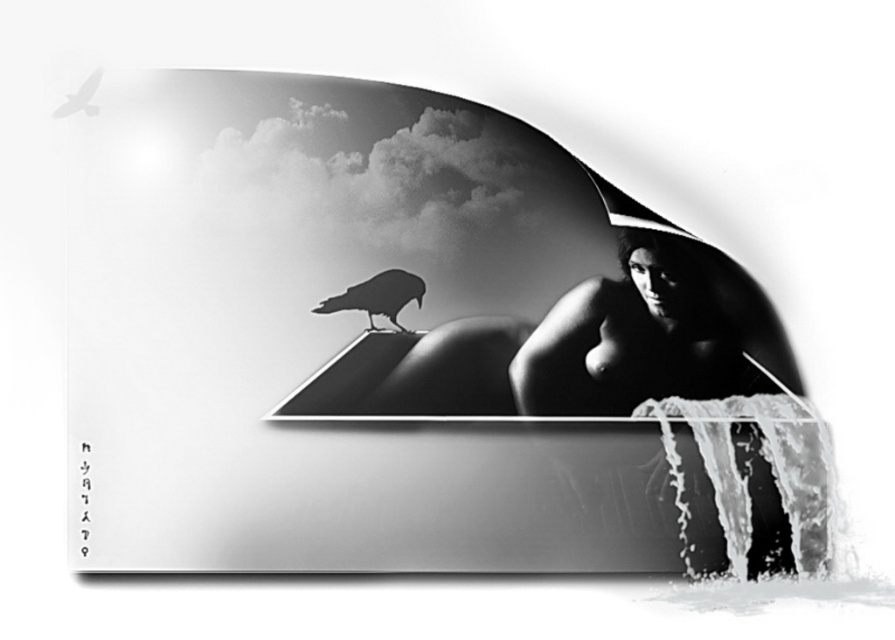
Locate an element on the screen. This screenshot has width=895, height=640. black matte bird at center is located at coordinates (377, 296).

Can you confirm if smooth skin woman at center is positioned above black matte crow at upper left?

Actually, smooth skin woman at center is below black matte crow at upper left.

Does smooth skin woman at center have a lesser height compared to black matte crow at upper left?

No, smooth skin woman at center is not shorter than black matte crow at upper left.

This screenshot has height=640, width=895. I want to click on smooth skin woman at center, so click(585, 346).

Looking at this image, does smooth skin woman at center appear on the left side of black matte bird at center?

No, smooth skin woman at center is not to the left of black matte bird at center.

Can you confirm if smooth skin woman at center is thinner than black matte bird at center?

Incorrect, smooth skin woman at center's width is not less than black matte bird at center's.

Is point (629, 365) positioned behind point (374, 305)?

Yes, point (629, 365) is behind point (374, 305).

This screenshot has height=640, width=895. Identify the location of smooth skin woman at center. (585, 346).